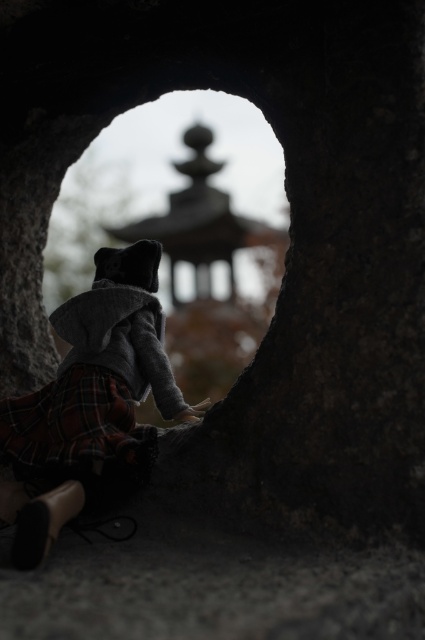
You are a photographer standing 3 feet away from the circular stone opening. You want to take a closeup shot of the plaid fabric skirt at center without moving the subject. Can you do it with your current position?

The plaid fabric skirt at center is 31.73 inches away from the viewer. Since 3 feet equals 36 inches, you are currently 36 inches away. To take a closeup, you need to move 4.27 inches closer to the plaid fabric skirt at center.

You are an interior designer assessing the spatial arrangement of the scene. You notice two plaid fabrics in the image. The first is the plaid fabric skirt at center, and the second is the plaid fabric at lower left. Which of these plaid fabrics appears taller in the image?

The plaid fabric skirt at center is much taller as plaid fabric at lower left.